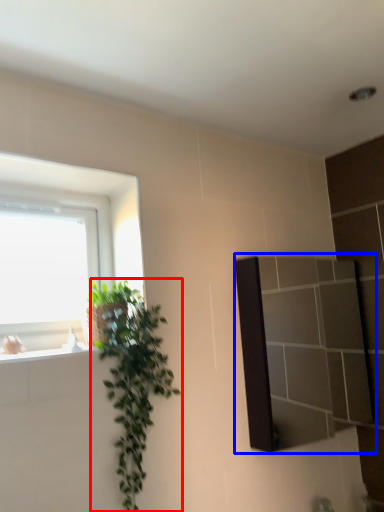
Question: Among these objects, which one is farthest to the camera, houseplant (highlighted by a red box) or mirror (highlighted by a blue box)?

Choices:
 (A) houseplant
 (B) mirror

Answer: (B)